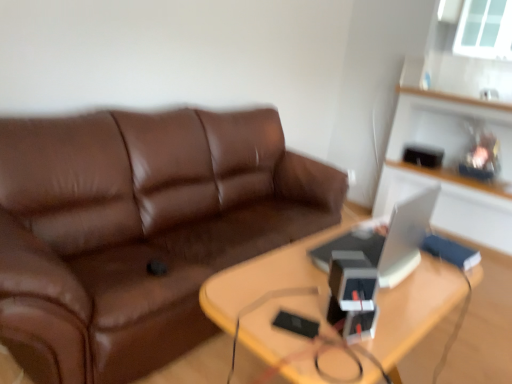
Locate an element on the screen. The height and width of the screenshot is (384, 512). free spot to the left of white glossy computer at right is located at coordinates (284, 269).